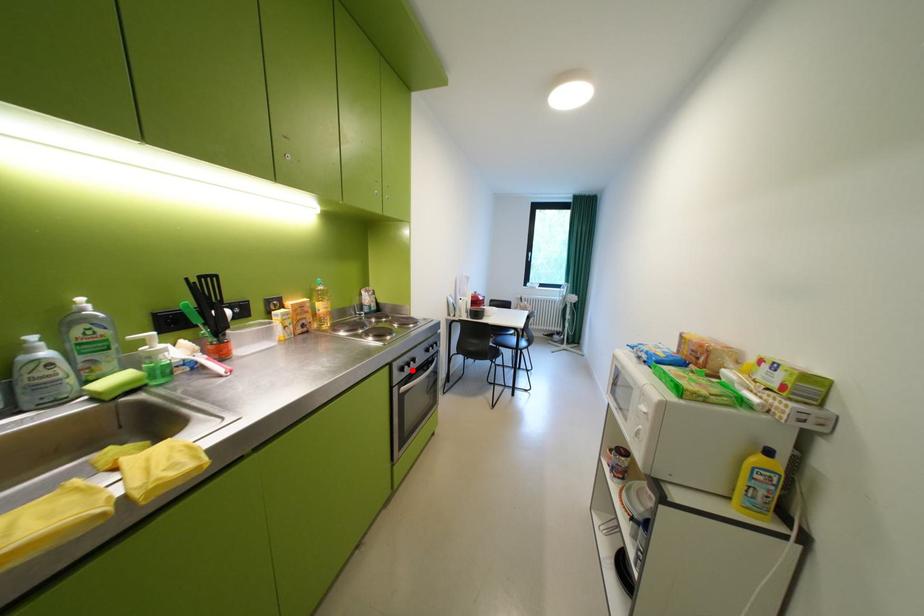
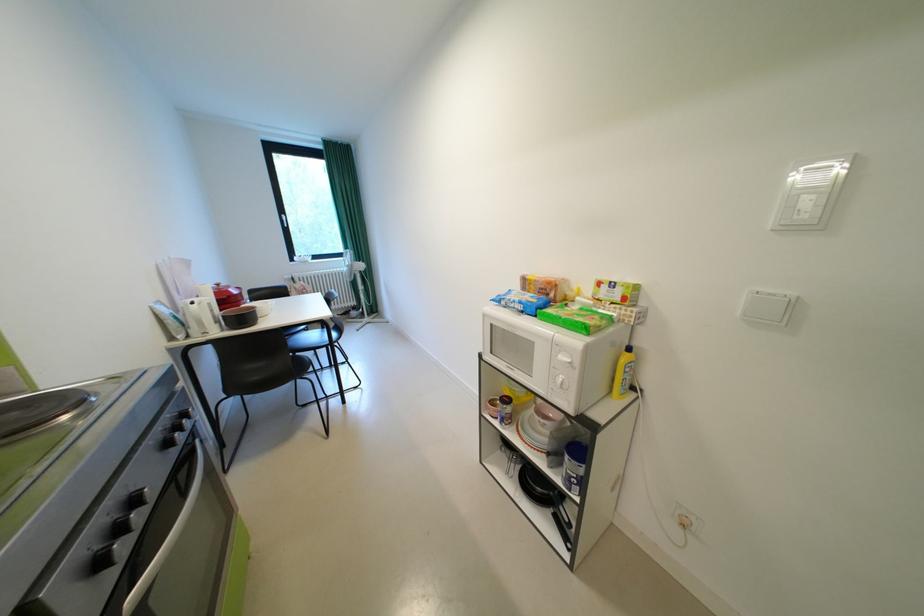
Locate, in the second image, the point that corresponds to the highlighted location in the first image.

(108, 565)